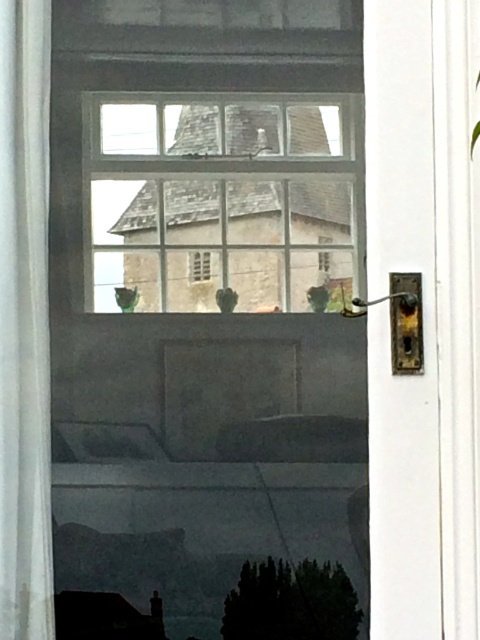
You are standing in front of the white door and want to see if the clear glass window at upper center is above the white fabric curtain at left. Can you confirm this based on the scene?

The clear glass window at upper center is positioned over the white fabric curtain at left, so yes, it is above it.

You are standing in front of the white glossy screen door at right and the green leafy plant at lower center. If you want to move from the door to the plant, which direction should you move towards?

Since the white glossy screen door at right has a lesser width compared to the green leafy plant at lower center, you should move towards the left to reach the plant.

You are standing in front of the white door with a glass panel. You notice the clear glass window at upper center and the white fabric curtain at left. Which object is closer to you, the observer?

The clear glass window at upper center is closer to you because the white fabric curtain at left is behind it.